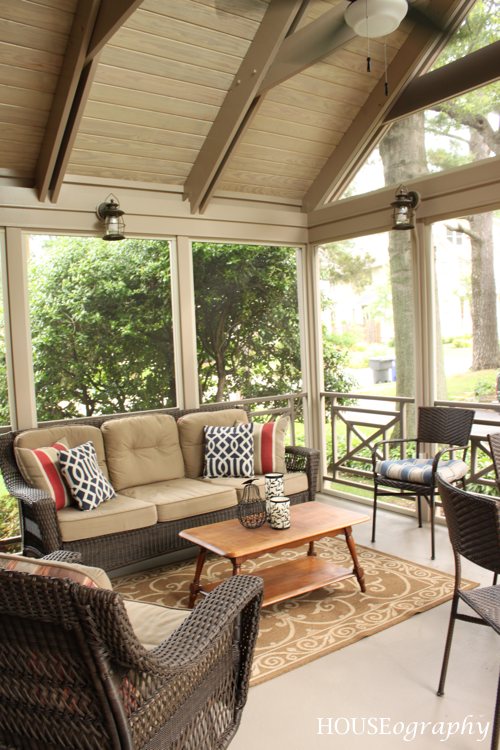
You are a GUI agent. You are given a task and a screenshot of the screen. Output one action in this format:
    pyautogui.click(x=<x>, y=<y>)
    Task: Click on the area rug
    
    Given the screenshot: What is the action you would take?
    pyautogui.click(x=299, y=628)